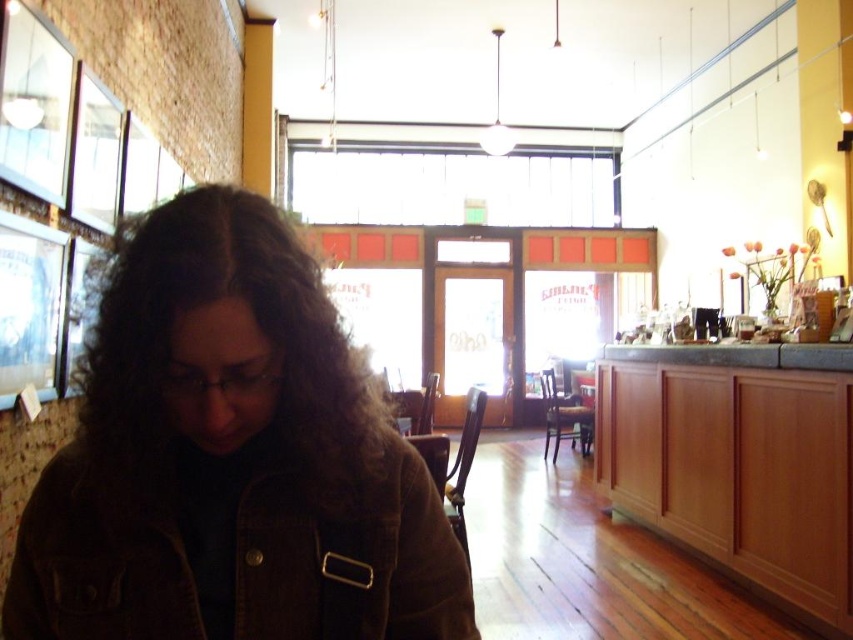
You are a customer in the cafe and want to place your small backpack on the nearest available surface. You see the brown suede jacket at lower left and the wooden cabinet at lower right. Which surface can you use without disturbing the jacket?

You can place your backpack on the wooden cabinet at lower right since it is larger than the brown suede jacket at lower left and likely has enough space.

Based on the photo, you are taking a photo of the scene and want to focus on both the point at (393, 573) and the point at (798, 456). Since you can only focus on one point clearly, which point should you choose to ensure the other is also somewhat in focus?

You should focus on point (393, 573) because it is closer to the camera, which will keep the point at (798, 456) in better focus compared to focusing on the farther point.

You are a customer in the cafe and want to place your phone on the table where the brown suede jacket at lower left is located. Is there enough space on the table for your phone?

The brown suede jacket at lower left is located at point (231, 458), so there is enough space on the table for your phone.